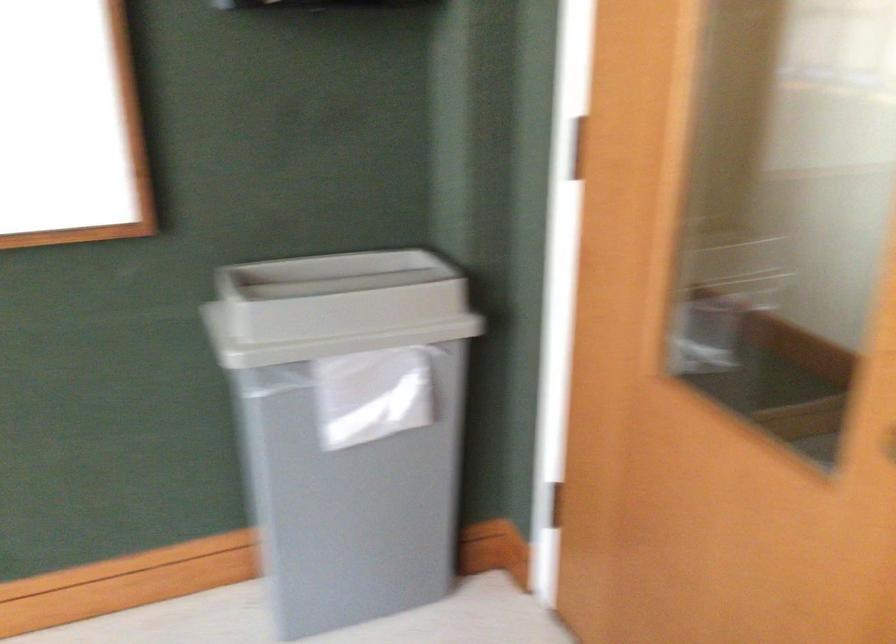
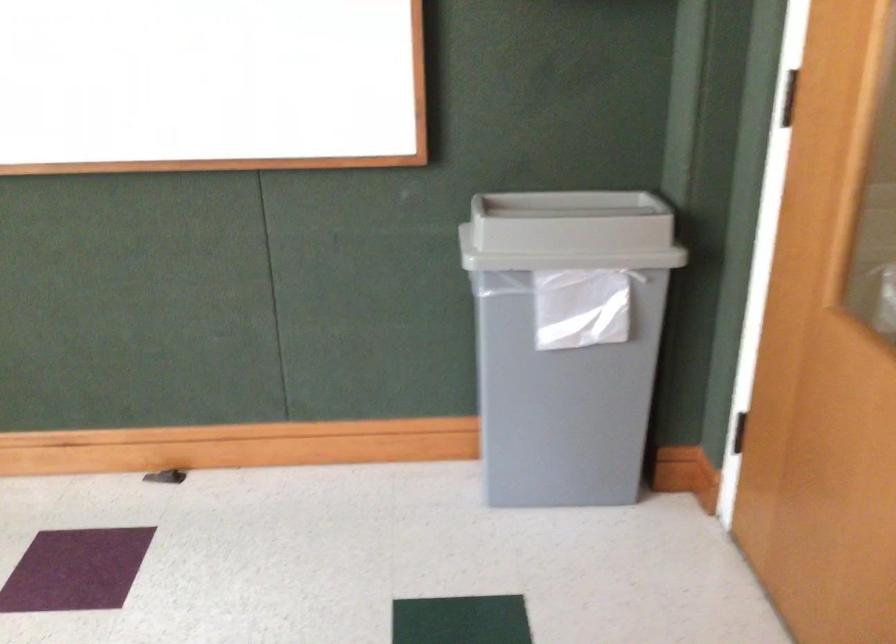
Question: The camera is either moving clockwise (left) or counter-clockwise (right) around the object. The first image is from the beginning of the video and the second image is from the end. Is the camera moving left or right when shooting the video?

Choices:
 (A) Left
 (B) Right

Answer: (B)